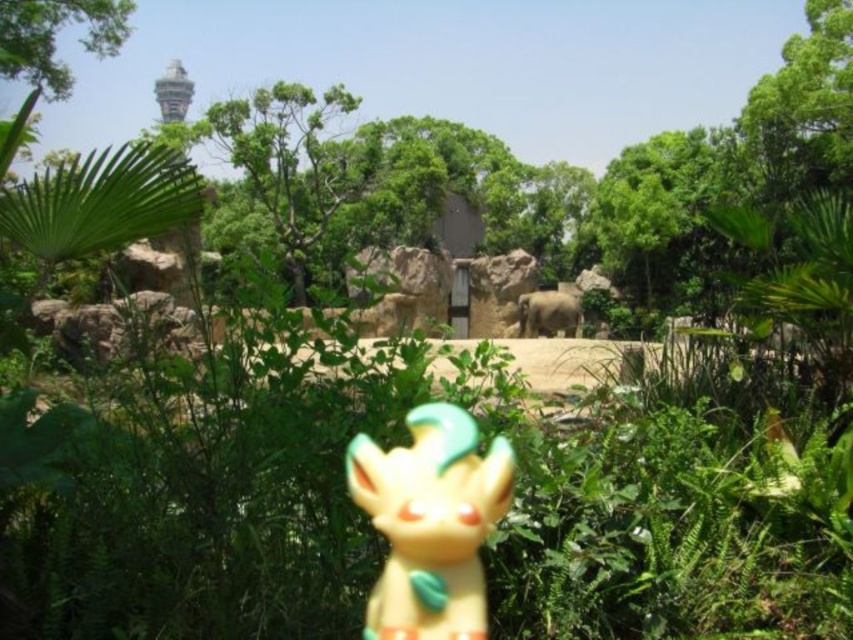
You are a zookeeper planning to trim the branches of the green leafy tree at upper left and the gray matte elephant at center. Which object requires a taller ladder to reach its top?

The gray matte elephant at center is larger than the green leafy tree at upper left, so a taller ladder would be needed for the gray matte elephant at center.

You are a zookeeper planning to place a new sign near the yellow matte figurine at center. The sign must be placed exactly at coordinates point 0.817, 0.505. Can you confirm if this location is accessible for placing the sign?

The yellow matte figurine at center is located at point (x=430, y=522), so yes, the sign can be placed there as it matches the exact coordinates provided.